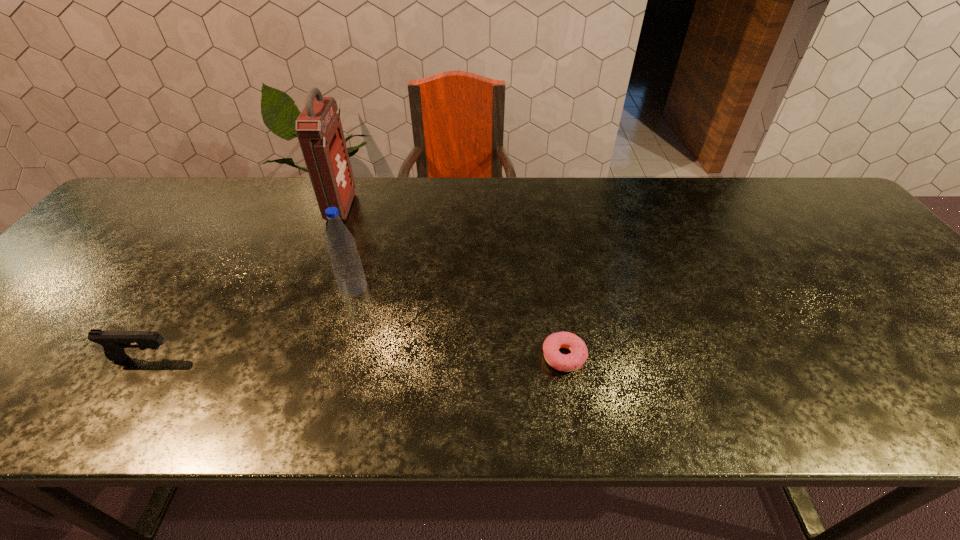
I want to click on unoccupied position between the leftmost object and the rightmost object, so click(x=353, y=357).

Image resolution: width=960 pixels, height=540 pixels. I want to click on vacant point located between the water bottle and the doughnut, so click(x=458, y=322).

Locate an element on the screen. blank region between the leftmost object and the second object from left to right is located at coordinates (243, 283).

In order to click on free space between the water bottle and the doughnut in this screenshot , I will do `click(458, 322)`.

The width and height of the screenshot is (960, 540). I want to click on free space between the pistol and the doughnut, so click(353, 357).

Locate an element on the screen. unoccupied area between the leftmost object and the doughnut is located at coordinates (353, 357).

Locate an element on the screen. The image size is (960, 540). free space between the leftmost object and the second object from right to left is located at coordinates (249, 323).

Where is `vacant point located between the first-aid kit and the doughnut`? The height and width of the screenshot is (540, 960). vacant point located between the first-aid kit and the doughnut is located at coordinates (452, 282).

At what (x,y) coordinates should I click in order to perform the action: click on the closest object to the leftmost object. Please return your answer as a coordinate pair (x, y). Looking at the image, I should click on (346, 264).

Select which object appears as the third closest to the rightmost object. Please provide its 2D coordinates. Your answer should be formatted as a tuple, i.e. [(x, y)], where the tuple contains the x and y coordinates of a point satisfying the conditions above.

[(113, 342)]